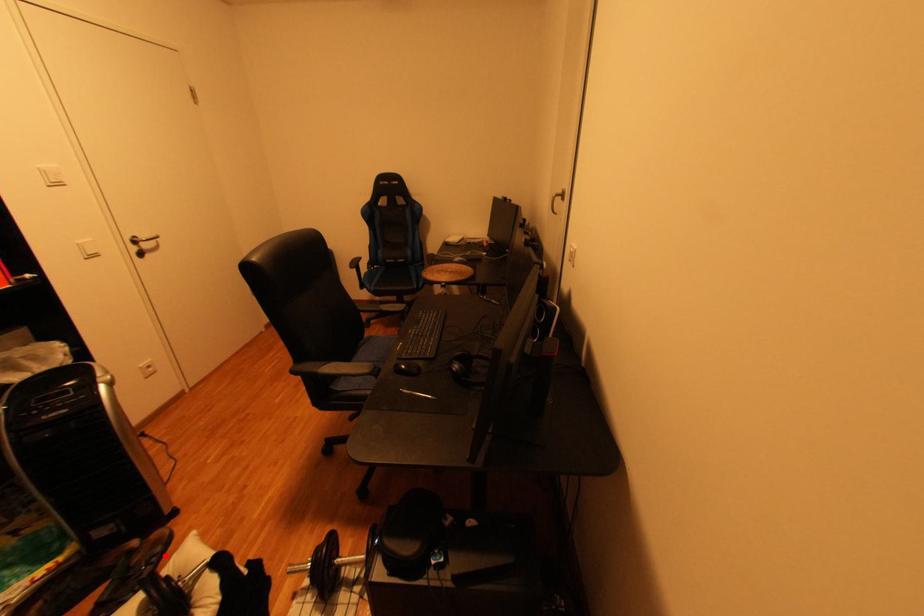
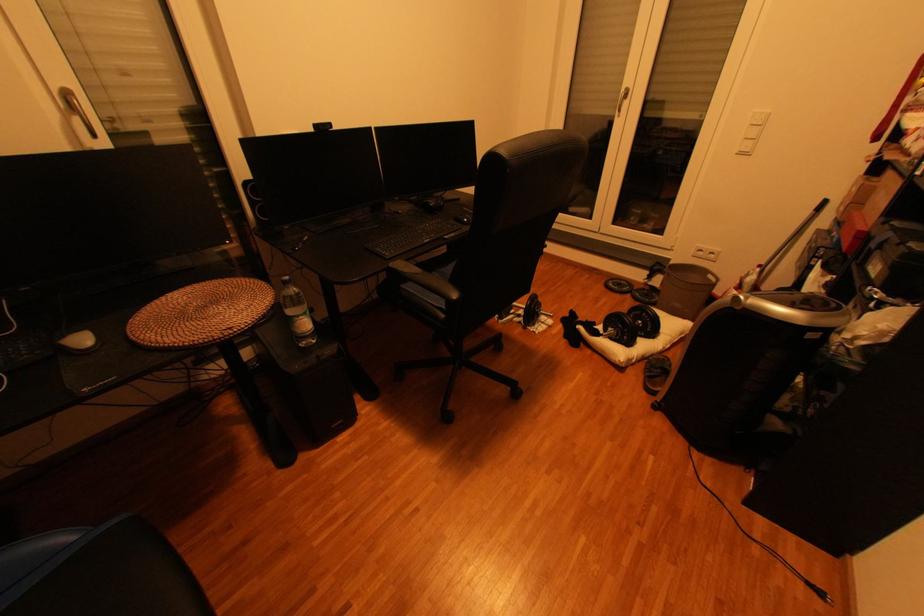
Locate, in the second image, the point that corresponds to the highlighted location in the first image.

(658, 373)